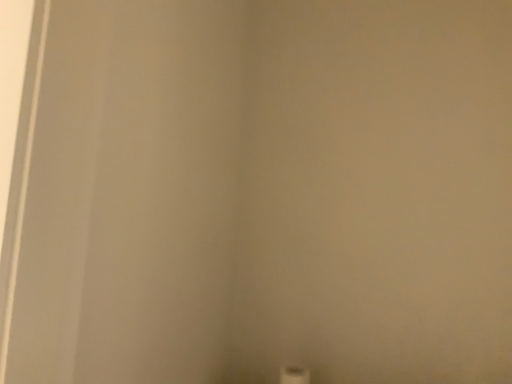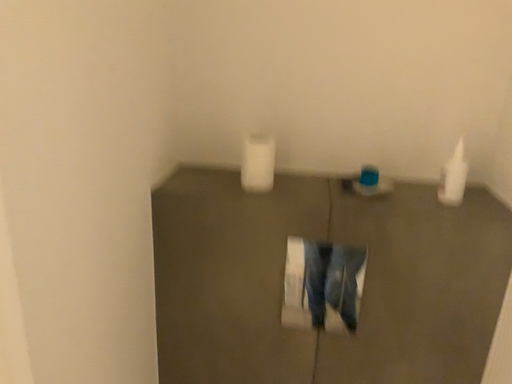
Question: Which way did the camera rotate in the video?

Choices:
 (A) rotated left
 (B) rotated right

Answer: (B)